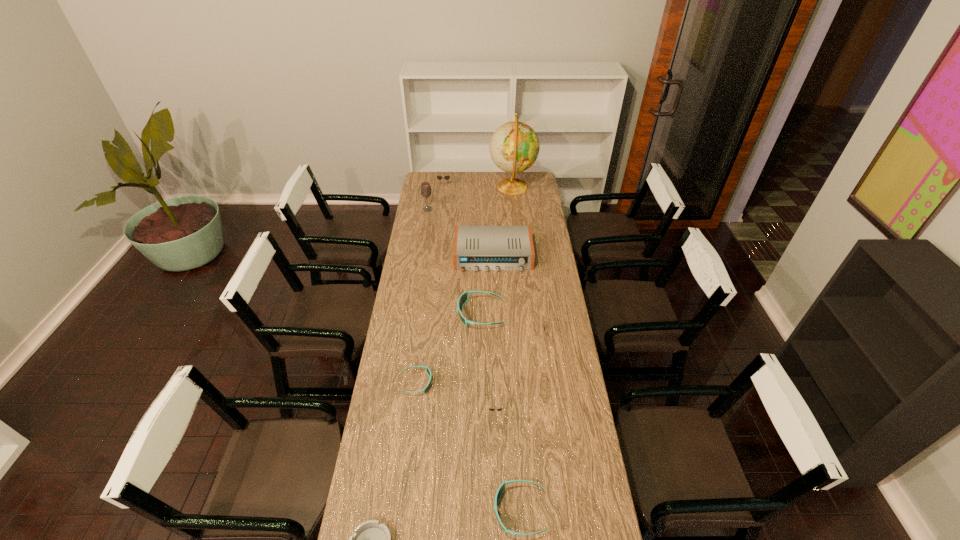
In the image, there is a desktop. Where is `vacant space at the far left corner`? This screenshot has height=540, width=960. vacant space at the far left corner is located at coordinates 439,185.

Identify the location of blank region between the shortest sunglasses and the seventh nearest object. The image size is (960, 540). (455, 319).

This screenshot has height=540, width=960. What are the coordinates of `free space between the radio receiver and the leftmost black sunglasses` in the screenshot? It's located at (468, 220).

Find the location of `free space between the shortest sunglasses and the rightmost sunglasses`. free space between the shortest sunglasses and the rightmost sunglasses is located at coordinates (483, 358).

At what (x,y) coordinates should I click in order to perform the action: click on vacant area that lies between the radio receiver and the globe. Please return your answer as a coordinate pair (x, y). The width and height of the screenshot is (960, 540). Looking at the image, I should click on (503, 221).

You are a GUI agent. You are given a task and a screenshot of the screen. Output one action in this format:
    pyautogui.click(x=<x>, y=<y>)
    Task: Click on the vacant point located between the tallest object and the nearest sunglasses
    
    Given the screenshot: What is the action you would take?
    pyautogui.click(x=516, y=349)

Locate an element on the screen. The height and width of the screenshot is (540, 960). free area in between the rightmost sunglasses and the farthest cyan sunglasses is located at coordinates (516, 323).

Identify which object is the seventh closest to the farthest black sunglasses. Please provide its 2D coordinates. Your answer should be formatted as a tuple, i.e. [(x, y)], where the tuple contains the x and y coordinates of a point satisfying the conditions above.

[(491, 409)]

The image size is (960, 540). I want to click on object that is the sixth closest to the leftmost black sunglasses, so click(x=428, y=370).

Locate an element on the screen. sunglasses that is the fifth closest to the biggest cyan sunglasses is located at coordinates (438, 177).